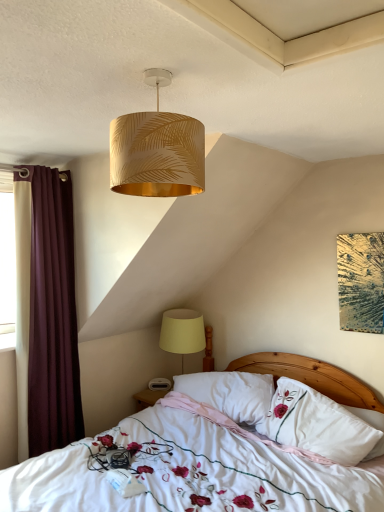
Question: Looking at the image, does maroon fabric curtain at left seem bigger or smaller compared to yellow fabric lampshade at lower center, the second lamp in the top-to-bottom sequence?

Choices:
 (A) small
 (B) big

Answer: (B)

Question: Considering the positions of maroon fabric curtain at left and yellow fabric lampshade at lower center, arranged as the second lamp when viewed from the front, in the image, is maroon fabric curtain at left taller or shorter than yellow fabric lampshade at lower center, arranged as the second lamp when viewed from the front,?

Choices:
 (A) tall
 (B) short

Answer: (A)

Question: Considering the real-world distances, which object is closest to the yellow fabric lampshade at lower center, arranged as the second lamp when viewed from the front?

Choices:
 (A) gold leaf-patterned lampshade at upper center, positioned as the second lamp in bottom-to-top order
 (B) white soft pillow at center, positioned as the 2th pillow in right-to-left order
 (C) white soft pillow at center, acting as the first pillow starting from the right
 (D) white floral fabric bed at center
 (E) maroon fabric curtain at left

Answer: (B)

Question: Which object is positioned closest to the maroon fabric curtain at left?

Choices:
 (A) gold leaf-patterned lampshade at upper center, acting as the second lamp starting from the back
 (B) white floral fabric bed at center
 (C) white soft pillow at center, acting as the first pillow starting from the right
 (D) yellow fabric lampshade at lower center, the first lamp in the bottom-to-top sequence
 (E) white soft pillow at center, positioned as the 2th pillow in right-to-left order

Answer: (D)